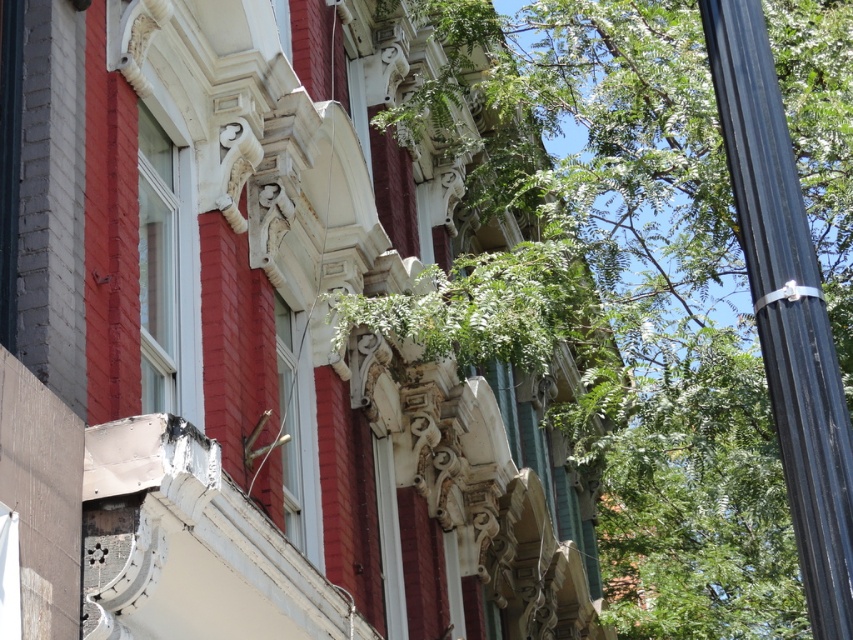
Question: Does green leafy tree at center appear over black metallic pole at right?

Choices:
 (A) yes
 (B) no

Answer: (A)

Question: Does green leafy tree at center have a lesser width compared to black metallic pole at right?

Choices:
 (A) no
 (B) yes

Answer: (A)

Question: Among these objects, which one is farthest from the camera?

Choices:
 (A) black metallic pole at right
 (B) green leafy tree at center

Answer: (B)

Question: Among these points, which one is farthest from the camera?

Choices:
 (A) (850, 20)
 (B) (782, 120)

Answer: (A)

Question: Is green leafy tree at center positioned before black metallic pole at right?

Choices:
 (A) no
 (B) yes

Answer: (A)